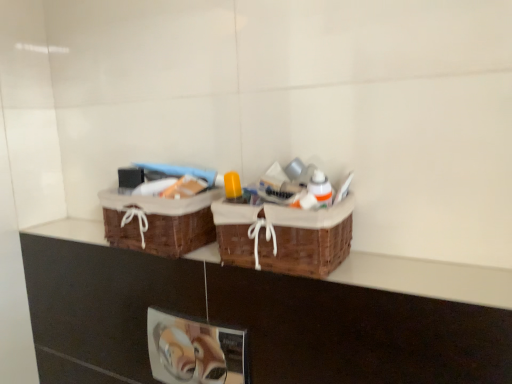
Question: Is woven brown picnic basket at center, the 2th picnic basket positioned from the left, at the right side of brown woven baskets at upper center?

Choices:
 (A) no
 (B) yes

Answer: (B)

Question: Is woven brown picnic basket at center, the first picnic basket when ordered from right to left, next to brown woven baskets at upper center?

Choices:
 (A) yes
 (B) no

Answer: (B)

Question: Is woven brown picnic basket at center, the first picnic basket when ordered from right to left, thinner than brown woven baskets at upper center?

Choices:
 (A) no
 (B) yes

Answer: (A)

Question: Does woven brown picnic basket at center, the first picnic basket when ordered from right to left, have a smaller size compared to brown woven baskets at upper center?

Choices:
 (A) yes
 (B) no

Answer: (B)

Question: Would you consider woven brown picnic basket at center, the first picnic basket when ordered from right to left, to be distant from brown woven baskets at upper center?

Choices:
 (A) yes
 (B) no

Answer: (B)

Question: Considering the positions of point (172, 254) and point (486, 322), is point (172, 254) closer or farther from the camera than point (486, 322)?

Choices:
 (A) farther
 (B) closer

Answer: (A)

Question: From the image's perspective, relative to brown woven baskets at upper center, is brown woven picnic basket at center, which is the first picnic basket in left-to-right order, above or below?

Choices:
 (A) below
 (B) above

Answer: (B)

Question: Considering their positions, is brown woven picnic basket at center, which is the first picnic basket in left-to-right order, located in front of or behind brown woven baskets at upper center?

Choices:
 (A) behind
 (B) front

Answer: (A)

Question: From their relative heights in the image, would you say brown woven picnic basket at center, positioned as the second picnic basket in right-to-left order, is taller or shorter than brown woven baskets at upper center?

Choices:
 (A) short
 (B) tall

Answer: (B)

Question: From a real-world perspective, is brown woven baskets at upper center above or below brown woven picnic basket at center, which is the first picnic basket in left-to-right order?

Choices:
 (A) above
 (B) below

Answer: (B)

Question: Looking at their shapes, would you say brown woven baskets at upper center is wider or thinner than brown woven picnic basket at center, positioned as the second picnic basket in right-to-left order?

Choices:
 (A) wide
 (B) thin

Answer: (B)

Question: Is brown woven baskets at upper center taller or shorter than brown woven picnic basket at center, positioned as the second picnic basket in right-to-left order?

Choices:
 (A) tall
 (B) short

Answer: (B)

Question: Is brown woven baskets at upper center bigger or smaller than brown woven picnic basket at center, which is the first picnic basket in left-to-right order?

Choices:
 (A) small
 (B) big

Answer: (A)

Question: From a real-world perspective, is brown woven baskets at upper center physically located above or below woven brown picnic basket at center, the first picnic basket when ordered from right to left?

Choices:
 (A) below
 (B) above

Answer: (A)

Question: In terms of width, does brown woven baskets at upper center look wider or thinner when compared to woven brown picnic basket at center, the 2th picnic basket positioned from the left?

Choices:
 (A) wide
 (B) thin

Answer: (B)